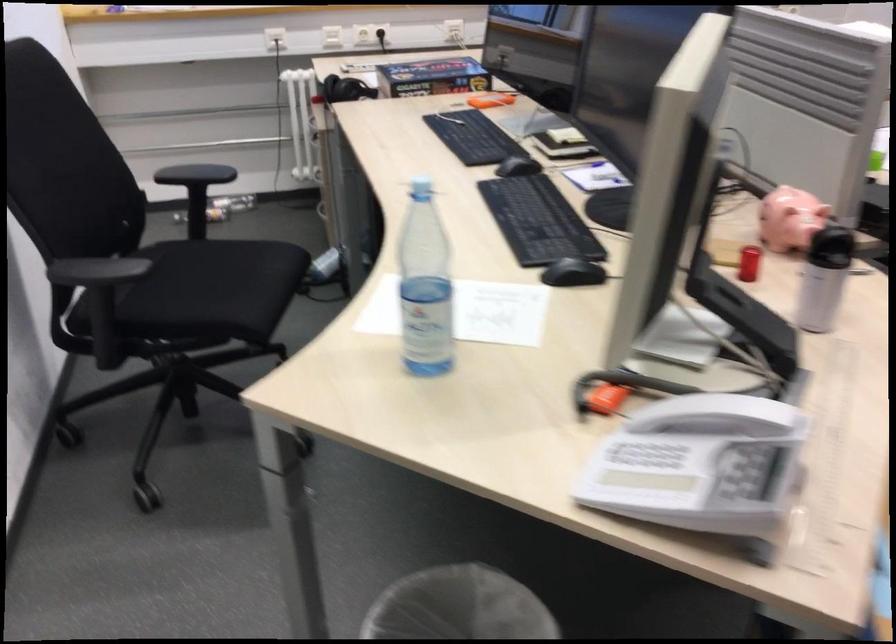
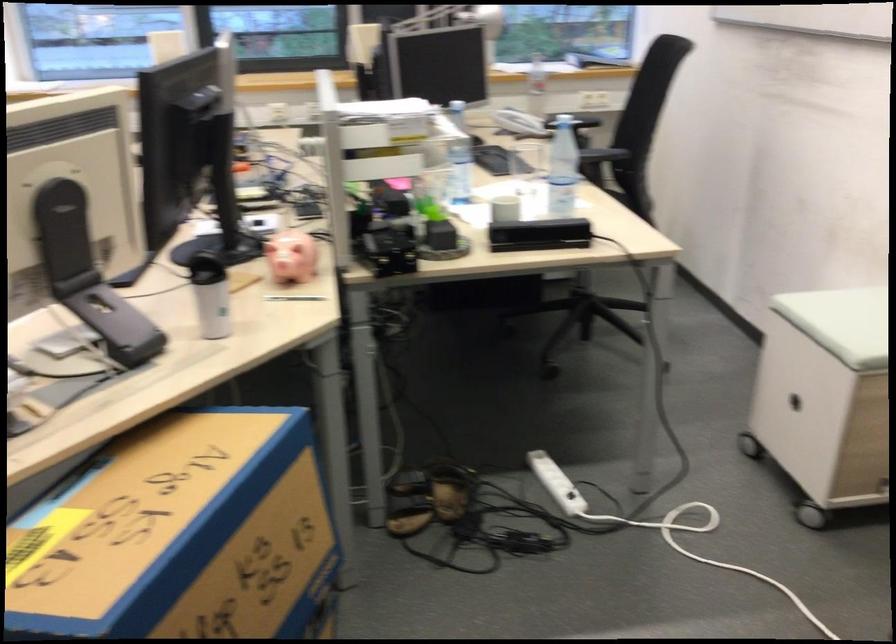
Find the pixel in the second image that matches the point at 806,216 in the first image.

(291, 257)